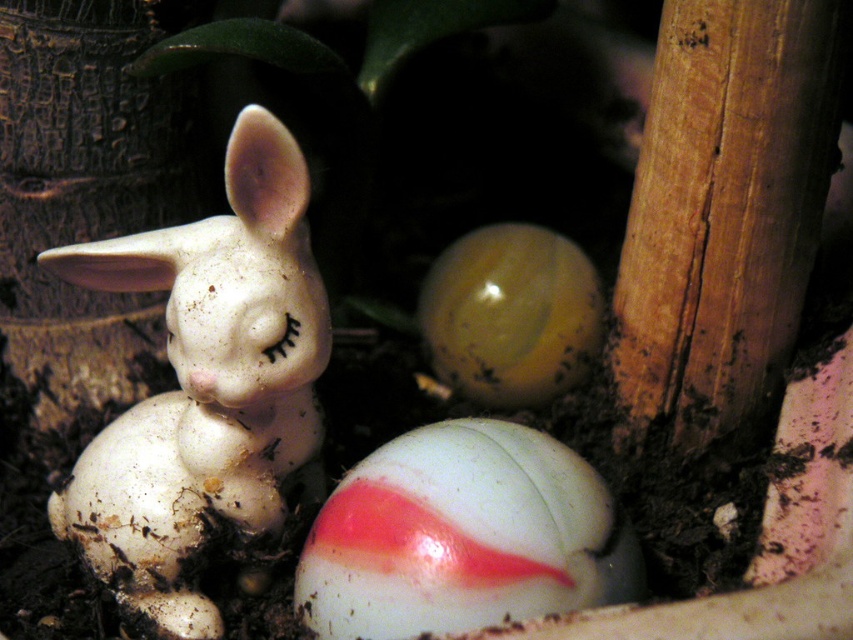
Question: Among these points, which one is nearest to the camera?

Choices:
 (A) (537, 385)
 (B) (143, 448)

Answer: (B)

Question: Which of these objects is positioned closest to the white glossy egg at center?

Choices:
 (A) translucent yellow egg at center
 (B) white matte rabbit at center

Answer: (B)

Question: Which object is positioned farthest from the white matte rabbit at center?

Choices:
 (A) translucent yellow egg at center
 (B) white glossy egg at center

Answer: (A)

Question: Can you confirm if white matte rabbit at center is positioned below translucent yellow egg at center?

Choices:
 (A) no
 (B) yes

Answer: (B)

Question: Can you confirm if white glossy egg at center is positioned above translucent yellow egg at center?

Choices:
 (A) yes
 (B) no

Answer: (B)

Question: Does white matte rabbit at center have a smaller size compared to white glossy egg at center?

Choices:
 (A) yes
 (B) no

Answer: (B)